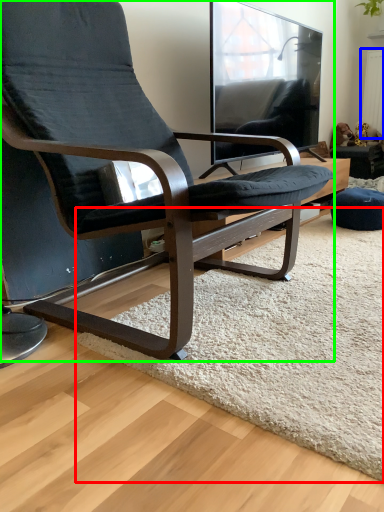
Question: Which is farther away from mat (highlighted by a red box)? radiator (highlighted by a blue box) or chair (highlighted by a green box)?

Choices:
 (A) radiator
 (B) chair

Answer: (A)